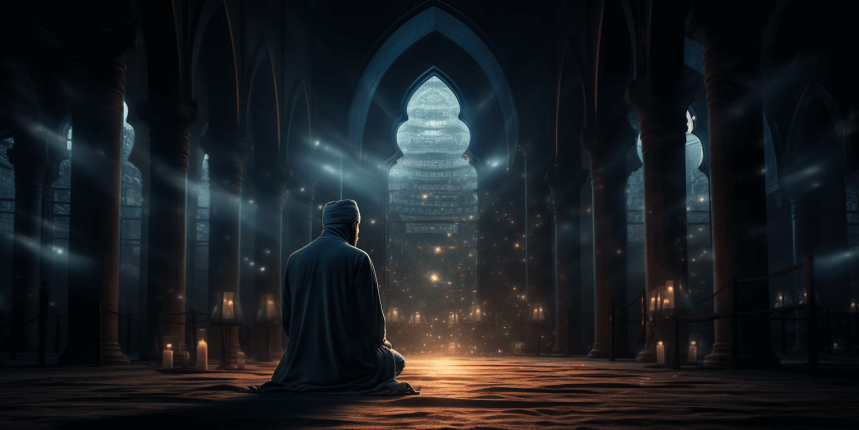
In order to click on the top of arched doorway in this screenshot , I will do coord(436,27).